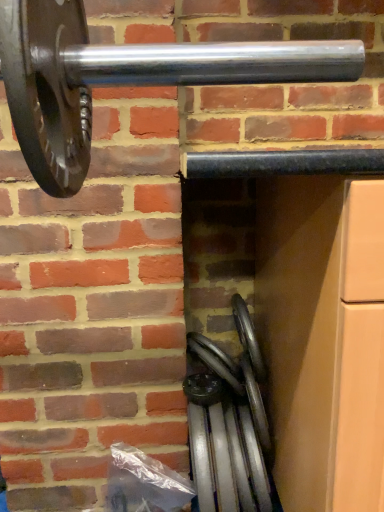
Locate an element on the screen. The width and height of the screenshot is (384, 512). metallic silver wheel at lower center, the second wheel in the bottom-to-top sequence is located at coordinates (216, 361).

This screenshot has width=384, height=512. What do you see at coordinates (216, 361) in the screenshot?
I see `metallic silver wheel at lower center, the second wheel in the bottom-to-top sequence` at bounding box center [216, 361].

What is the approximate width of metallic silver wheel at lower center, the 1th wheel positioned from the top?

metallic silver wheel at lower center, the 1th wheel positioned from the top, is 7.82 inches wide.

What is the approximate width of polished silver wheel at lower center, which is counted as the 2th wheel, starting from the top?

It is 9.66 inches.

Measure the distance between polished silver wheel at lower center, which is counted as the 2th wheel, starting from the top, and camera.

A distance of 32.62 inches exists between polished silver wheel at lower center, which is counted as the 2th wheel, starting from the top, and camera.

Identify the location of polished silver wheel at lower center, which is counted as the 2th wheel, starting from the top. (229, 423).

The height and width of the screenshot is (512, 384). Describe the element at coordinates (229, 423) in the screenshot. I see `polished silver wheel at lower center, which is counted as the 2th wheel, starting from the top` at that location.

Locate an element on the screen. The image size is (384, 512). metallic silver wheel at lower center, the 1th wheel positioned from the top is located at coordinates (216, 361).

Considering the positions of objects polished silver wheel at lower center, which is counted as the 2th wheel, starting from the top, and metallic silver wheel at lower center, the second wheel in the bottom-to-top sequence, in the image provided, who is more to the right, polished silver wheel at lower center, which is counted as the 2th wheel, starting from the top, or metallic silver wheel at lower center, the second wheel in the bottom-to-top sequence,?

polished silver wheel at lower center, which is counted as the 2th wheel, starting from the top, is more to the right.

Does polished silver wheel at lower center, which is counted as the 1th wheel, starting from the bottom, come in front of metallic silver wheel at lower center, the 1th wheel positioned from the top?

Yes, it is in front of metallic silver wheel at lower center, the 1th wheel positioned from the top.

Which is more distant, (245, 479) or (219, 362)?

The point (219, 362) is farther.

From the image's perspective, is polished silver wheel at lower center, which is counted as the 1th wheel, starting from the bottom, located above metallic silver wheel at lower center, the 1th wheel positioned from the top?

No.

From a real-world perspective, is polished silver wheel at lower center, which is counted as the 1th wheel, starting from the bottom, positioned above or below metallic silver wheel at lower center, the 1th wheel positioned from the top?

polished silver wheel at lower center, which is counted as the 1th wheel, starting from the bottom, is below metallic silver wheel at lower center, the 1th wheel positioned from the top.

Is polished silver wheel at lower center, which is counted as the 2th wheel, starting from the top, wider than metallic silver wheel at lower center, the 1th wheel positioned from the top?

Indeed, polished silver wheel at lower center, which is counted as the 2th wheel, starting from the top, has a greater width compared to metallic silver wheel at lower center, the 1th wheel positioned from the top.

Considering the relative sizes of polished silver wheel at lower center, which is counted as the 1th wheel, starting from the bottom, and metallic silver wheel at lower center, the 1th wheel positioned from the top, in the image provided, is polished silver wheel at lower center, which is counted as the 1th wheel, starting from the bottom, shorter than metallic silver wheel at lower center, the 1th wheel positioned from the top,?

Incorrect, the height of polished silver wheel at lower center, which is counted as the 1th wheel, starting from the bottom, does not fall short of that of metallic silver wheel at lower center, the 1th wheel positioned from the top.

Does polished silver wheel at lower center, which is counted as the 1th wheel, starting from the bottom, have a smaller size compared to metallic silver wheel at lower center, the 1th wheel positioned from the top?

Incorrect, polished silver wheel at lower center, which is counted as the 1th wheel, starting from the bottom, is not smaller in size than metallic silver wheel at lower center, the 1th wheel positioned from the top.

Is polished silver wheel at lower center, which is counted as the 1th wheel, starting from the bottom, surrounding metallic silver wheel at lower center, the 1th wheel positioned from the top?

No, metallic silver wheel at lower center, the 1th wheel positioned from the top, is located outside of polished silver wheel at lower center, which is counted as the 1th wheel, starting from the bottom.

Would you consider polished silver wheel at lower center, which is counted as the 1th wheel, starting from the bottom, to be distant from metallic silver wheel at lower center, the 1th wheel positioned from the top?

polished silver wheel at lower center, which is counted as the 1th wheel, starting from the bottom, is near metallic silver wheel at lower center, the 1th wheel positioned from the top, not far away.

Is metallic silver wheel at lower center, the 1th wheel positioned from the top, at the back of polished silver wheel at lower center, which is counted as the 2th wheel, starting from the top?

No.

Can you tell me how much polished silver wheel at lower center, which is counted as the 2th wheel, starting from the top, and metallic silver wheel at lower center, the 1th wheel positioned from the top, differ in facing direction?

0.000119 degrees.

The image size is (384, 512). I want to click on wheel to the left of polished silver wheel at lower center, which is counted as the 1th wheel, starting from the bottom, so click(x=216, y=361).

Considering the relative positions of metallic silver wheel at lower center, the second wheel in the bottom-to-top sequence, and polished silver wheel at lower center, which is counted as the 2th wheel, starting from the top, in the image provided, is metallic silver wheel at lower center, the second wheel in the bottom-to-top sequence, to the right of polished silver wheel at lower center, which is counted as the 2th wheel, starting from the top, from the viewer's perspective?

Incorrect, metallic silver wheel at lower center, the second wheel in the bottom-to-top sequence, is not on the right side of polished silver wheel at lower center, which is counted as the 2th wheel, starting from the top.

Who is more distant, metallic silver wheel at lower center, the second wheel in the bottom-to-top sequence, or polished silver wheel at lower center, which is counted as the 2th wheel, starting from the top?

Positioned behind is metallic silver wheel at lower center, the second wheel in the bottom-to-top sequence.

Which is nearer, (215, 354) or (246, 325)?

Clearly, point (215, 354) is closer to the camera than point (246, 325).

From the image's perspective, which one is positioned higher, metallic silver wheel at lower center, the 1th wheel positioned from the top, or polished silver wheel at lower center, which is counted as the 2th wheel, starting from the top?

metallic silver wheel at lower center, the 1th wheel positioned from the top, appears higher in the image.

From a real-world perspective, is metallic silver wheel at lower center, the second wheel in the bottom-to-top sequence, above or below polished silver wheel at lower center, which is counted as the 2th wheel, starting from the top?

metallic silver wheel at lower center, the second wheel in the bottom-to-top sequence, is situated higher than polished silver wheel at lower center, which is counted as the 2th wheel, starting from the top, in the real world.

From the picture: Which of these two, metallic silver wheel at lower center, the second wheel in the bottom-to-top sequence, or polished silver wheel at lower center, which is counted as the 2th wheel, starting from the top, is wider?

polished silver wheel at lower center, which is counted as the 2th wheel, starting from the top.

From their relative heights in the image, would you say metallic silver wheel at lower center, the second wheel in the bottom-to-top sequence, is taller or shorter than polished silver wheel at lower center, which is counted as the 1th wheel, starting from the bottom?

Clearly, metallic silver wheel at lower center, the second wheel in the bottom-to-top sequence, is shorter compared to polished silver wheel at lower center, which is counted as the 1th wheel, starting from the bottom.

Between metallic silver wheel at lower center, the second wheel in the bottom-to-top sequence, and polished silver wheel at lower center, which is counted as the 2th wheel, starting from the top, which one has smaller size?

Smaller between the two is metallic silver wheel at lower center, the second wheel in the bottom-to-top sequence.

Is polished silver wheel at lower center, which is counted as the 2th wheel, starting from the top, completely or partially inside metallic silver wheel at lower center, the second wheel in the bottom-to-top sequence?

No, polished silver wheel at lower center, which is counted as the 2th wheel, starting from the top, is not inside metallic silver wheel at lower center, the second wheel in the bottom-to-top sequence.

Is metallic silver wheel at lower center, the second wheel in the bottom-to-top sequence, beside polished silver wheel at lower center, which is counted as the 2th wheel, starting from the top?

Yes, metallic silver wheel at lower center, the second wheel in the bottom-to-top sequence, is in contact with polished silver wheel at lower center, which is counted as the 2th wheel, starting from the top.

Is polished silver wheel at lower center, which is counted as the 1th wheel, starting from the bottom, at the back of metallic silver wheel at lower center, the 1th wheel positioned from the top?

No, metallic silver wheel at lower center, the 1th wheel positioned from the top, is not facing away from polished silver wheel at lower center, which is counted as the 1th wheel, starting from the bottom.

What's the angular difference between metallic silver wheel at lower center, the 1th wheel positioned from the top, and polished silver wheel at lower center, which is counted as the 1th wheel, starting from the bottom,'s facing directions?

There is a 0.000119-degree angle between the facing directions of metallic silver wheel at lower center, the 1th wheel positioned from the top, and polished silver wheel at lower center, which is counted as the 1th wheel, starting from the bottom.

Locate an element on the screen. Image resolution: width=384 pixels, height=512 pixels. wheel below the metallic silver wheel at lower center, the 1th wheel positioned from the top (from a real-world perspective) is located at coordinates (229, 423).

This screenshot has height=512, width=384. There is a polished silver wheel at lower center, which is counted as the 2th wheel, starting from the top. In order to click on wheel above it (from a real-world perspective) in this screenshot , I will do click(x=216, y=361).

This screenshot has height=512, width=384. Find the location of `wheel behind the polished silver wheel at lower center, which is counted as the 1th wheel, starting from the bottom`. wheel behind the polished silver wheel at lower center, which is counted as the 1th wheel, starting from the bottom is located at coordinates (216, 361).